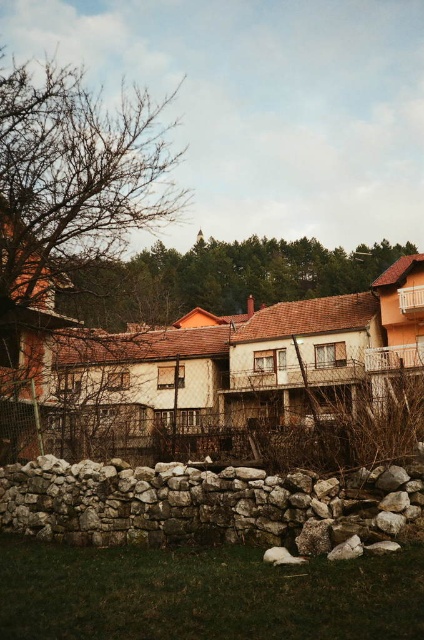
You are standing at the camera position observing the rural scene. There is a specific point marked at coordinates point (70, 205). Can you estimate how far this point is from your current position?

The distance of point (70, 205) from camera is 17.12 meters.

You are standing in the rural scene and want to determine the relative positions of two points marked in the image. Which point, point [346,509] or point [89,305], is closer to you?

Point [346,509] is closer to the viewer than point [89,305].